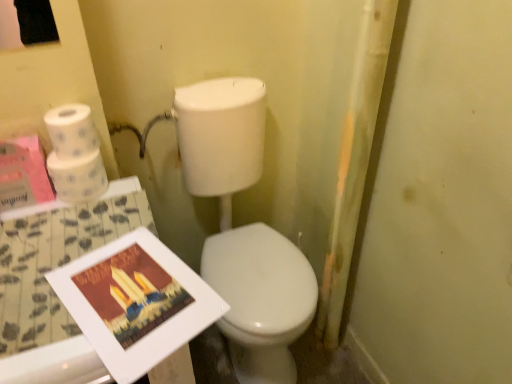
Question: From the image's perspective, is white matte toilet paper at upper left, marked as the first toilet paper in a top-to-bottom arrangement, under white matte toilet paper at upper left, arranged as the 2th toilet paper when viewed from the top?

Choices:
 (A) no
 (B) yes

Answer: (A)

Question: From a real-world perspective, does white matte toilet paper at upper left, marked as the first toilet paper in a top-to-bottom arrangement, sit lower than white matte toilet paper at upper left, arranged as the 2th toilet paper when viewed from the top?

Choices:
 (A) no
 (B) yes

Answer: (A)

Question: Does white matte toilet paper at upper left, which is counted as the second toilet paper, starting from the bottom, turn towards white matte toilet paper at upper left, the 1th toilet paper positioned from the bottom?

Choices:
 (A) yes
 (B) no

Answer: (B)

Question: Considering the relative positions of white matte toilet paper at upper left, marked as the first toilet paper in a top-to-bottom arrangement, and white matte toilet paper at upper left, arranged as the 2th toilet paper when viewed from the top, in the image provided, is white matte toilet paper at upper left, marked as the first toilet paper in a top-to-bottom arrangement, behind white matte toilet paper at upper left, arranged as the 2th toilet paper when viewed from the top,?

Choices:
 (A) yes
 (B) no

Answer: (B)

Question: Does white matte toilet paper at upper left, marked as the first toilet paper in a top-to-bottom arrangement, come in front of white matte toilet paper at upper left, the 1th toilet paper positioned from the bottom?

Choices:
 (A) no
 (B) yes

Answer: (B)

Question: Are white matte toilet paper at upper left, which is counted as the second toilet paper, starting from the bottom, and white matte toilet paper at upper left, the 1th toilet paper positioned from the bottom, beside each other?

Choices:
 (A) no
 (B) yes

Answer: (B)

Question: Considering the relative sizes of white matte toilet paper at upper left, which is counted as the second toilet paper, starting from the bottom, and white glossy toilet at center in the image provided, is white matte toilet paper at upper left, which is counted as the second toilet paper, starting from the bottom, bigger than white glossy toilet at center?

Choices:
 (A) no
 (B) yes

Answer: (A)

Question: Is white matte toilet paper at upper left, which is counted as the second toilet paper, starting from the bottom, turned away from white glossy toilet at center?

Choices:
 (A) no
 (B) yes

Answer: (A)

Question: Is white matte toilet paper at upper left, marked as the first toilet paper in a top-to-bottom arrangement, surrounding white glossy toilet at center?

Choices:
 (A) yes
 (B) no

Answer: (B)

Question: Is white matte toilet paper at upper left, marked as the first toilet paper in a top-to-bottom arrangement, not inside white glossy toilet at center?

Choices:
 (A) no
 (B) yes

Answer: (B)

Question: From a real-world perspective, is white matte toilet paper at upper left, which is counted as the second toilet paper, starting from the bottom, over white glossy toilet at center?

Choices:
 (A) no
 (B) yes

Answer: (B)

Question: From the image's perspective, is white matte toilet paper at upper left, marked as the first toilet paper in a top-to-bottom arrangement, located beneath white glossy toilet at center?

Choices:
 (A) yes
 (B) no

Answer: (B)

Question: Is white matte toilet paper at upper left, marked as the first toilet paper in a top-to-bottom arrangement, closer to camera compared to white glossy table at lower left?

Choices:
 (A) yes
 (B) no

Answer: (B)